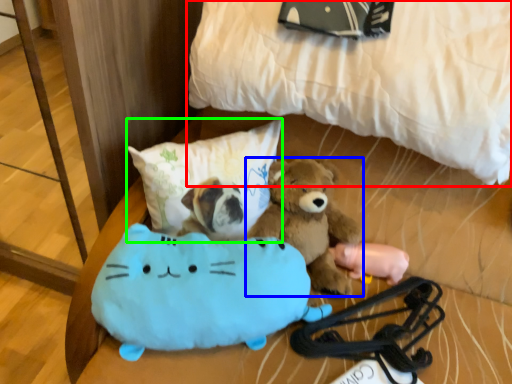
Question: Which is farther away from bed (highlighted by a red box)? teddy bear (highlighted by a blue box) or pillow (highlighted by a green box)?

Choices:
 (A) teddy bear
 (B) pillow

Answer: (A)